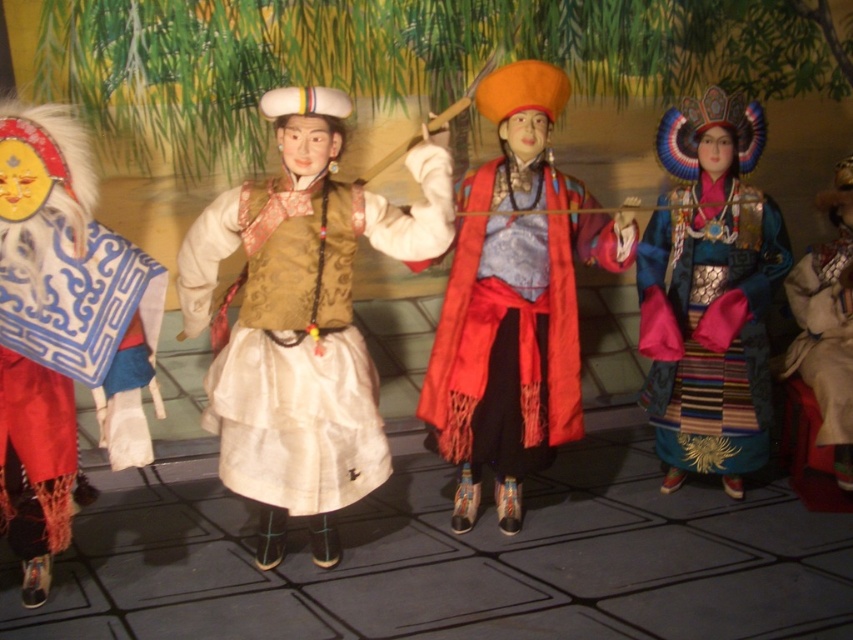
You are an anthropologist observing the scene. You notice the satin beige vest at center and the silky red robe at center. Which clothing item has a shorter vertical length?

The satin beige vest at center has a lesser height compared to the silky red robe at center, so the satin beige vest at center is shorter vertically.